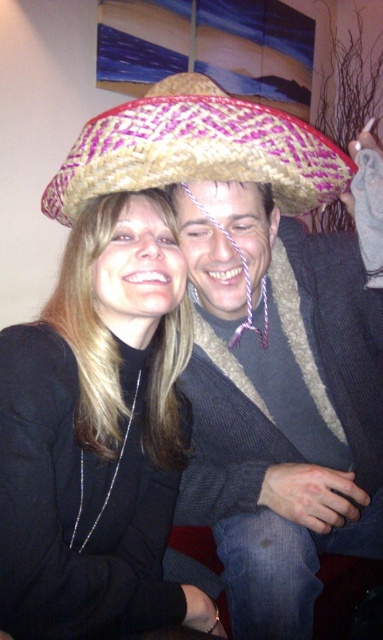
Question: Is woven straw sombrero at center bigger than matte straw sombrero at upper center?

Choices:
 (A) yes
 (B) no

Answer: (A)

Question: Does woven straw sombrero at center have a larger size compared to matte straw sombrero at upper center?

Choices:
 (A) no
 (B) yes

Answer: (B)

Question: Which of the following is the farthest from the observer?

Choices:
 (A) woven straw sombrero at center
 (B) matte straw sombrero at upper center
 (C) bright pink woven straw sombrero at center

Answer: (A)

Question: Which is nearer to the woven straw sombrero at center?

Choices:
 (A) matte straw sombrero at upper center
 (B) bright pink woven straw sombrero at center

Answer: (A)

Question: Is woven straw sombrero at center behind matte straw sombrero at upper center?

Choices:
 (A) no
 (B) yes

Answer: (B)

Question: Which point is farther to the camera?

Choices:
 (A) (356, 244)
 (B) (117, 356)
 (C) (173, 80)

Answer: (A)